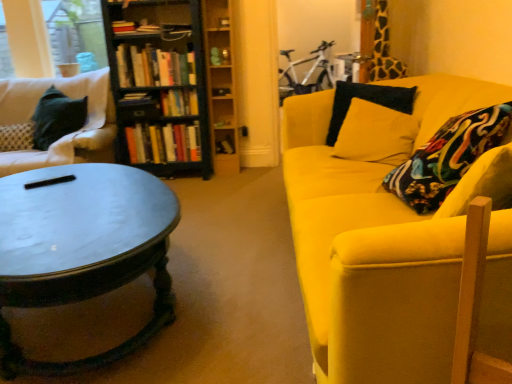
What are the coordinates of `free point behind matte black coffee table at left` in the screenshot? It's located at (216, 208).